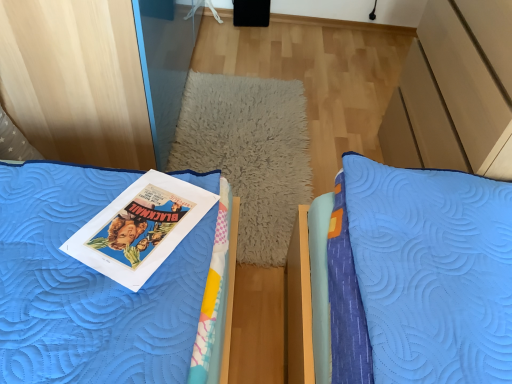
Locate an element on the screen. This screenshot has height=384, width=512. white fluffy pillow at center is located at coordinates (249, 153).

What do you see at coordinates (249, 153) in the screenshot? I see `white fluffy pillow at center` at bounding box center [249, 153].

Describe the element at coordinates (140, 228) in the screenshot. I see `matte paper book at center` at that location.

What is the approximate height of matte paper book at center?

matte paper book at center is 2.99 inches tall.

You are a GUI agent. You are given a task and a screenshot of the screen. Output one action in this format:
    pyautogui.click(x=<x>, y=<y>)
    Task: Click on the matte paper book at center
    
    Given the screenshot: What is the action you would take?
    pyautogui.click(x=140, y=228)

The image size is (512, 384). I want to click on white fluffy pillow at center, so click(249, 153).

Would you say white fluffy pillow at center is to the left or to the right of matte paper book at center in the picture?

Clearly, white fluffy pillow at center is on the right of matte paper book at center in the image.

Is white fluffy pillow at center behind matte paper book at center?

Yes, it is.

Which point is more forward, (x=257, y=121) or (x=123, y=217)?

The point (x=123, y=217) is in front.

From the image's perspective, which one is positioned lower, white fluffy pillow at center or matte paper book at center?

matte paper book at center, from the image's perspective.

From a real-world perspective, is white fluffy pillow at center located higher than matte paper book at center?

No, from a real-world perspective, white fluffy pillow at center is not on top of matte paper book at center.

Looking at their sizes, would you say white fluffy pillow at center is wider or thinner than matte paper book at center?

Considering their sizes, white fluffy pillow at center looks broader than matte paper book at center.

Between white fluffy pillow at center and matte paper book at center, which one has less height?

white fluffy pillow at center.

Considering the relative sizes of white fluffy pillow at center and matte paper book at center in the image provided, is white fluffy pillow at center smaller than matte paper book at center?

No.

Is white fluffy pillow at center spatially inside matte paper book at center, or outside of it?

white fluffy pillow at center is located beyond the bounds of matte paper book at center.

Are white fluffy pillow at center and matte paper book at center making contact?

No, white fluffy pillow at center is not with matte paper book at center.

Is white fluffy pillow at center turned away from matte paper book at center?

No.

What are the coordinates of `pillow on the right of matte paper book at center` in the screenshot? It's located at (249, 153).

Based on their positions, is matte paper book at center located to the left or right of white fluffy pillow at center?

matte paper book at center is to the left of white fluffy pillow at center.

Between matte paper book at center and white fluffy pillow at center, which one is positioned in front?

matte paper book at center is closer to the camera.

Which is farther from the camera, (189, 198) or (200, 117)?

The point (200, 117) is farther.

Consider the image. From the image's perspective, is matte paper book at center beneath white fluffy pillow at center?

Correct, matte paper book at center appears lower than white fluffy pillow at center in the image.

From a real-world perspective, which object rests below the other?

white fluffy pillow at center is physically lower.

Does matte paper book at center have a greater width compared to white fluffy pillow at center?

Incorrect, the width of matte paper book at center does not surpass that of white fluffy pillow at center.

Can you confirm if matte paper book at center is shorter than white fluffy pillow at center?

In fact, matte paper book at center may be taller than white fluffy pillow at center.

Consider the image. Does matte paper book at center have a smaller size compared to white fluffy pillow at center?

Yes.

Is white fluffy pillow at center located within matte paper book at center?

No, white fluffy pillow at center is not surrounded by matte paper book at center.

Is matte paper book at center directly adjacent to white fluffy pillow at center?

They are not placed beside each other.

Is matte paper book at center facing away from white fluffy pillow at center?

No, matte paper book at center is not facing the opposite direction of white fluffy pillow at center.

How many degrees apart are the facing directions of matte paper book at center and white fluffy pillow at center?

The angular difference between matte paper book at center and white fluffy pillow at center is 26.7 degrees.

Measure the distance between matte paper book at center and white fluffy pillow at center.

The distance of matte paper book at center from white fluffy pillow at center is 33.24 inches.

Image resolution: width=512 pixels, height=384 pixels. Identify the location of pillow that appears behind the matte paper book at center. (249, 153).

What are the coordinates of `pillow behind the matte paper book at center` in the screenshot? It's located at (249, 153).

The height and width of the screenshot is (384, 512). I want to click on book above the white fluffy pillow at center (from a real-world perspective), so click(140, 228).